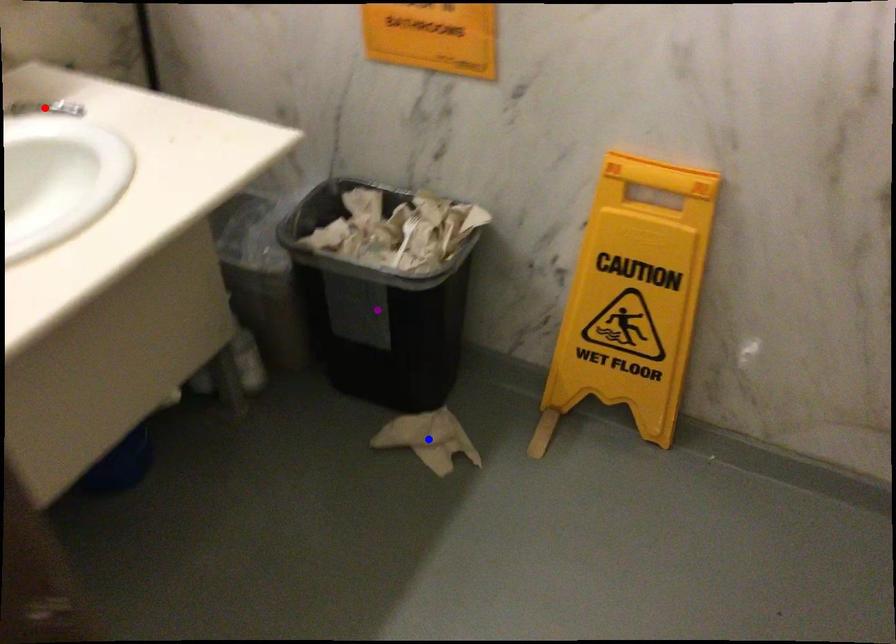
Order these from nearest to farthest:
blue point
red point
purple point

1. red point
2. purple point
3. blue point